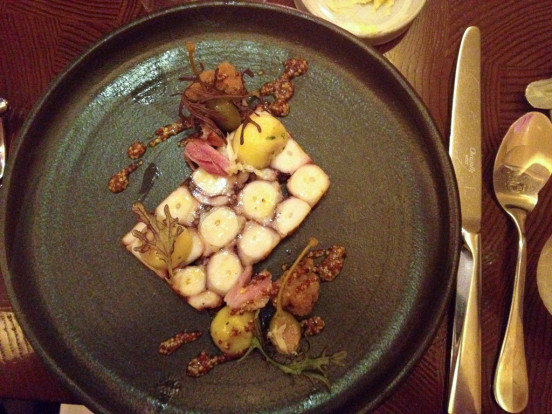
Identify the location of white dish. (389, 14).